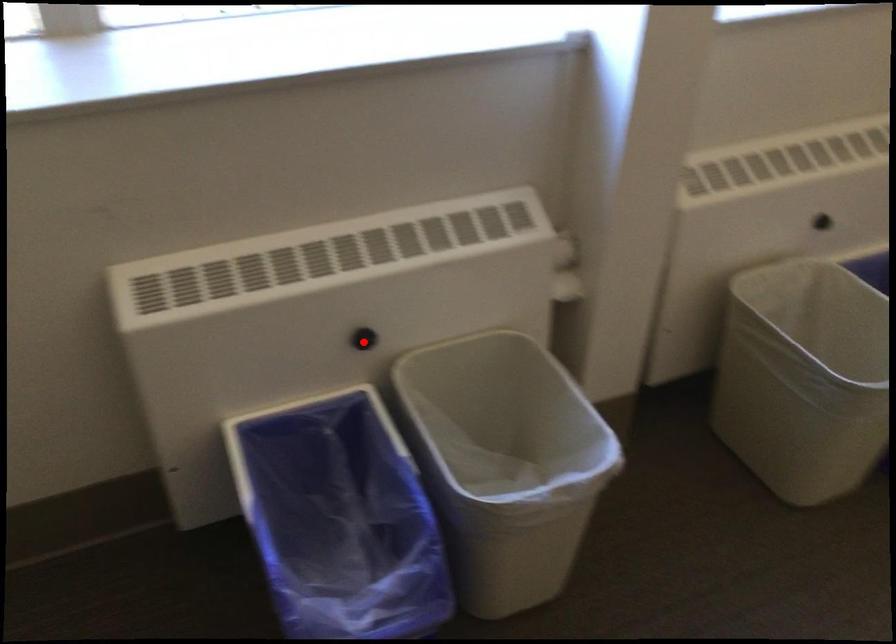
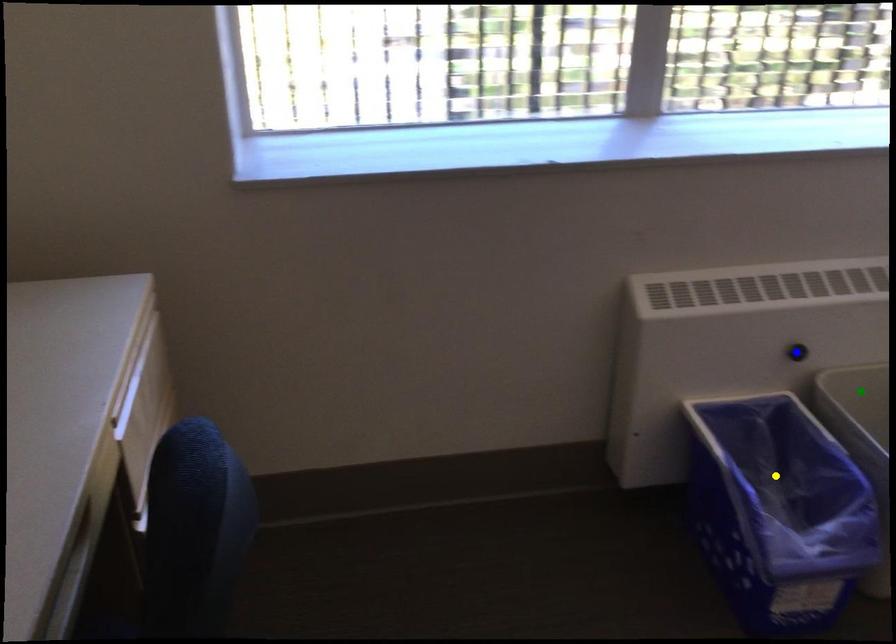
Question: I am providing you with two images of the same scene from different viewpoints. A red point is marked on the first image. You are given multiple points on the second image. Which mark in image 2 goes with the point in image 1?

Choices:
 (A) blue point
 (B) green point
 (C) yellow point

Answer: (A)